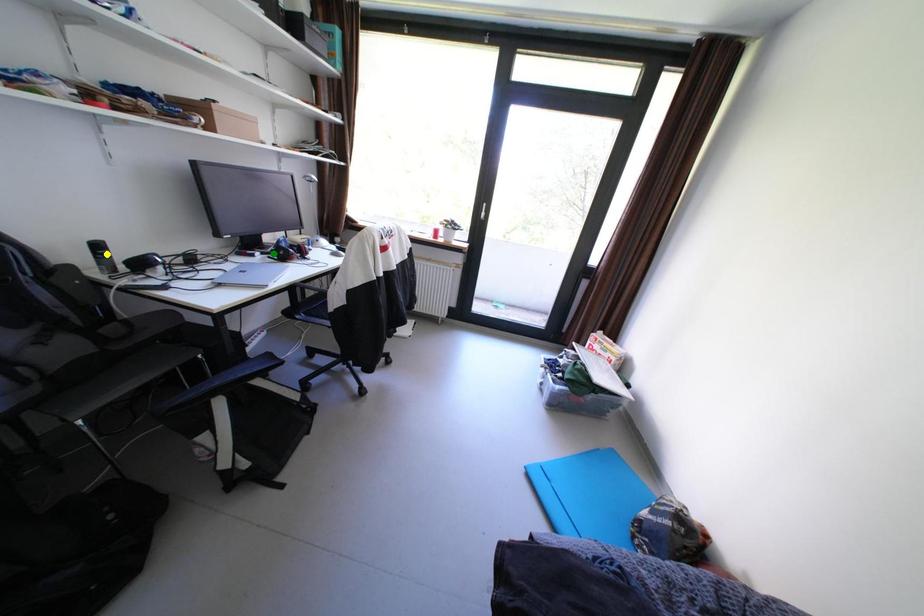
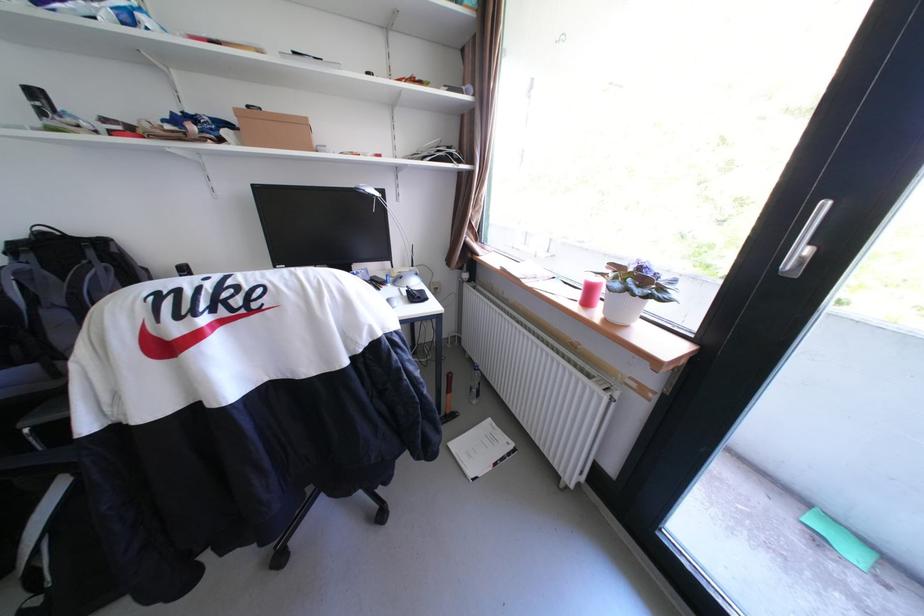
I am providing you with two images of the same scene from different viewpoints. Three points are marked in image1. Which point corresponds to a part or object that is occluded in image2?In image1, three points are marked. Which of them correspond to a part or object that is occluded in image2?Among the three points shown in image1, which one corresponds to a part or object that is no longer visible due to occlusion in image2?

blue point, yellow point, green point